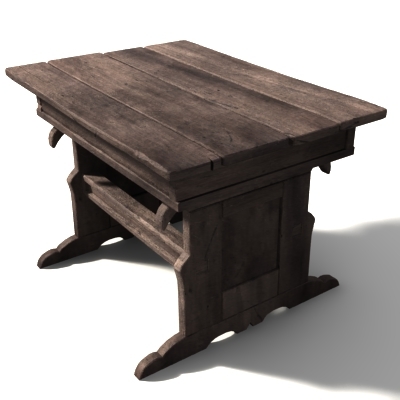
Find the location of a particular element. This screenshot has height=400, width=400. table top boards is located at coordinates (171, 109), (226, 92), (144, 132), (302, 88).